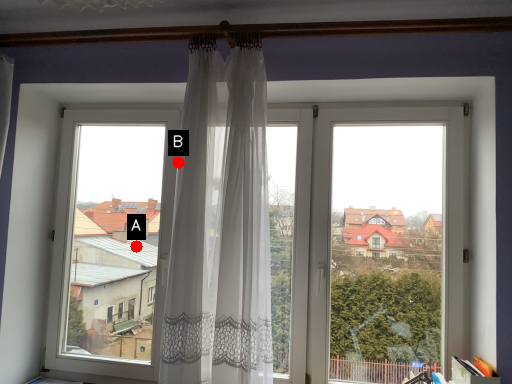
Question: Two points are circled on the image, labeled by A and B beside each circle. Which point is closer to the camera?

Choices:
 (A) A is closer
 (B) B is closer

Answer: (B)